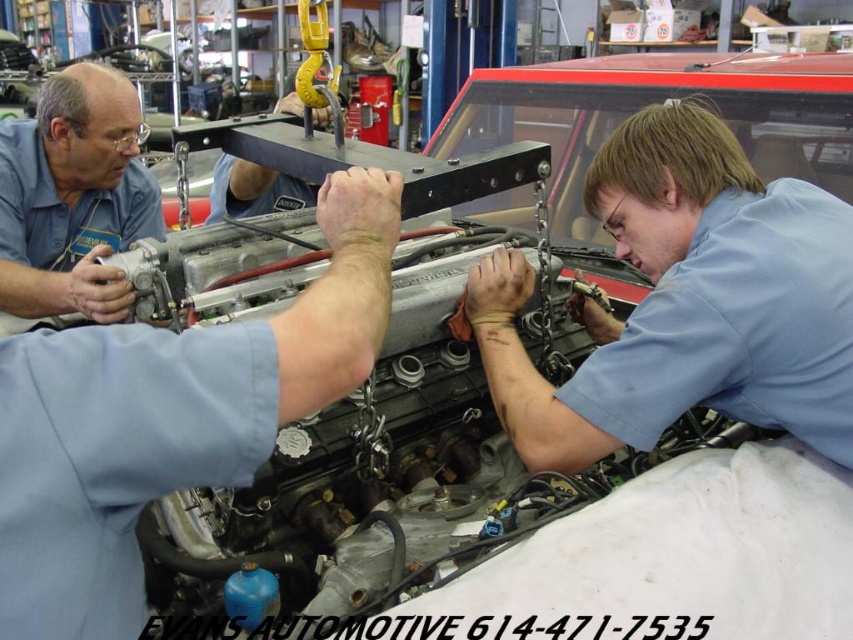
Does point (746, 410) come farther from viewer compared to point (18, 300)?

No, (746, 410) is closer to viewer.

Is point (717, 278) closer to camera compared to point (44, 176)?

Yes, it is.

What do you see at coordinates (686, 301) in the screenshot? The width and height of the screenshot is (853, 640). I see `matte silver engine at center` at bounding box center [686, 301].

What are the coordinates of `matte silver engine at center` in the screenshot? It's located at (686, 301).